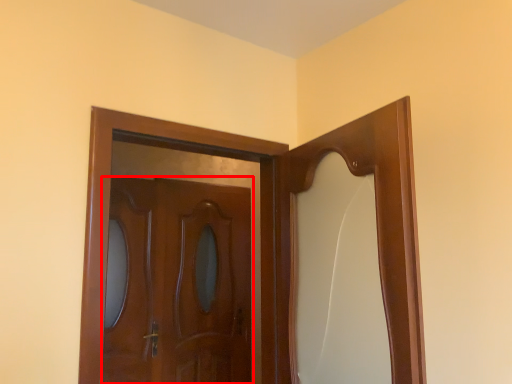
Question: From the image's perspective, where is door (annotated by the red box) located in relation to door in the image?

Choices:
 (A) below
 (B) above

Answer: (A)